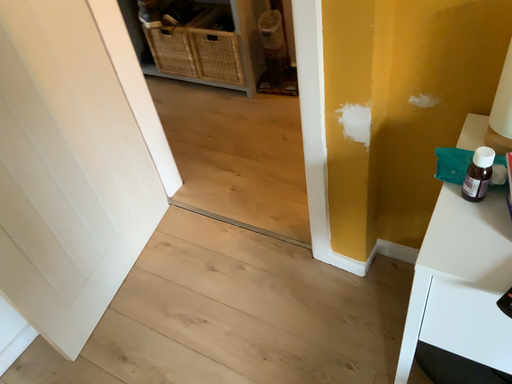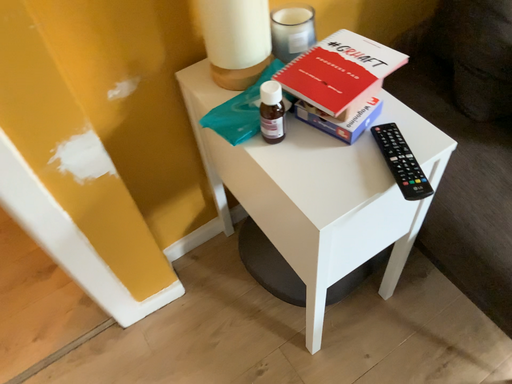
Question: How did the camera likely rotate when shooting the video?

Choices:
 (A) rotated left
 (B) rotated right

Answer: (B)